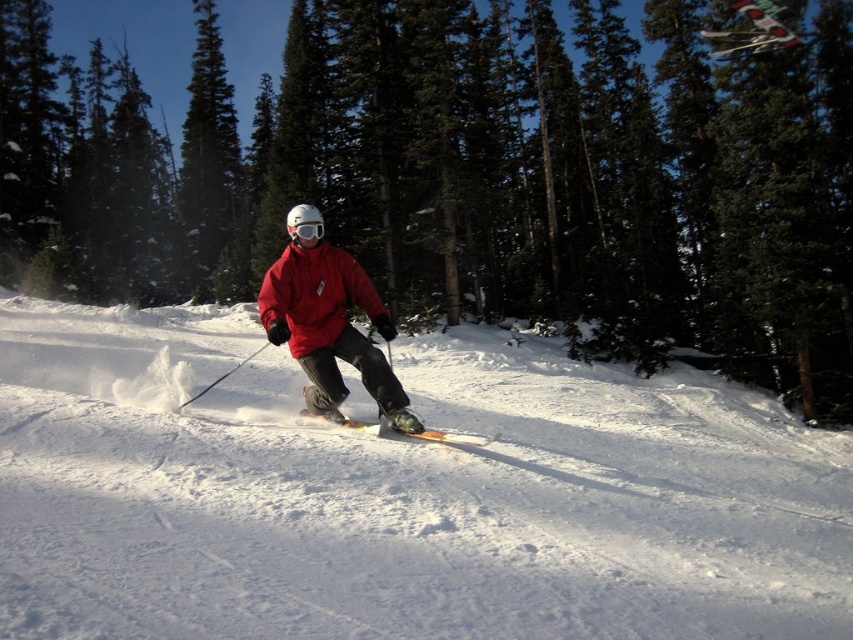
You are a photographer trying to capture the skier in the scene. Given that the white powdery snow at center and the matte red jacket at center are both in your camera frame, which object takes up more space in the photo?

The white powdery snow at center takes up more space in the photo because it is bigger than the matte red jacket at center according to the description.

You are a photographer taking a picture of the scene. You want to capture the matte red jacket at center and the white powdery snow at center in your shot. Based on their positions, which object is positioned to the right side of the other?

The white powdery snow at center is to the right of the matte red jacket at center.

From the picture: You are a photographer trying to capture the skier in the image. You want to ensure the white matte goggles at center are clearly visible against the white powdery snow at center. Based on their positions, will the goggles be easy to see? Explain why or why not.

The white powdery snow at center is taller than white matte goggles at center. Since the snow is taller, it might cover part of the goggles, making them less visible. The similar white color could also cause blending, so the goggles might not be easy to see.